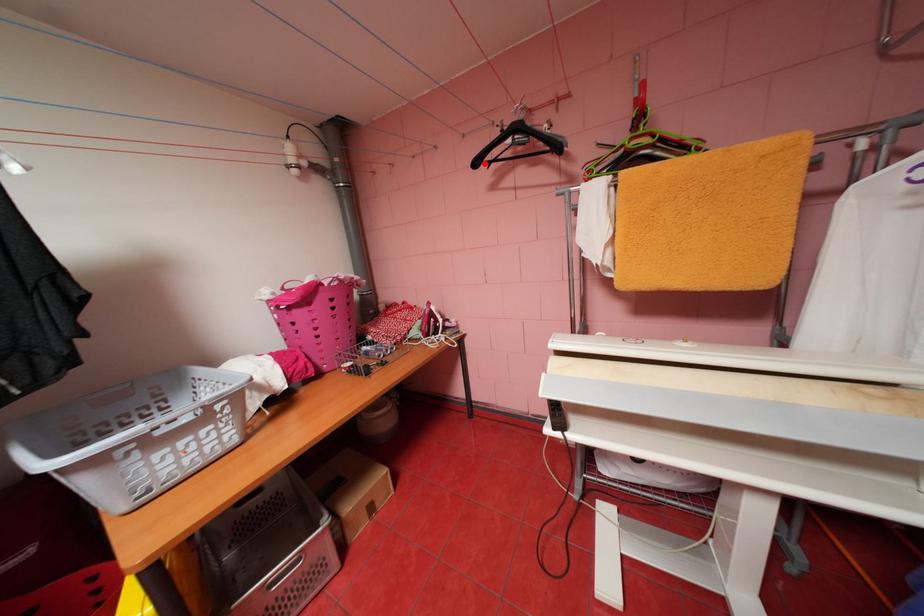
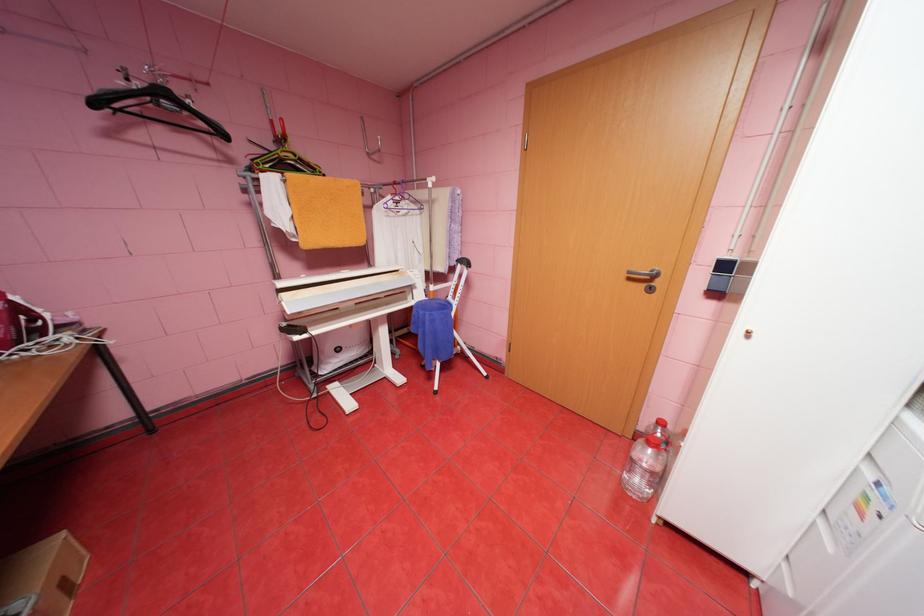
Where in the second image is the point corresponding to the highlighted location from the first image?

(103, 103)